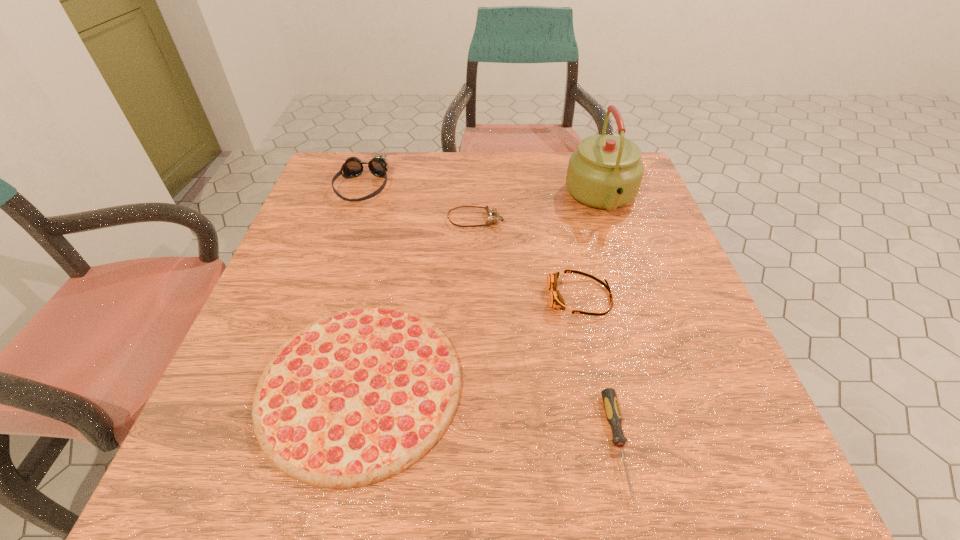
At what (x,y) coordinates should I click in order to perform the action: click on vacant space located through the lenses of the second tallest object. Please return your answer as a coordinate pair (x, y). Looking at the image, I should click on (330, 281).

The image size is (960, 540). What are the coordinates of `free space located with the lenses facing forward on the third tallest object` in the screenshot? It's located at (514, 298).

This screenshot has width=960, height=540. In order to click on vacant area situated 0.390m with the lenses facing forward on the third tallest object in this screenshot , I will do (x=355, y=298).

This screenshot has width=960, height=540. I want to click on vacant region located 0.160m with the lenses facing forward on the third tallest object, so click(x=468, y=298).

Where is `free region located on the front lenses and sides of the second goggles from left to right`? free region located on the front lenses and sides of the second goggles from left to right is located at coordinates pyautogui.click(x=656, y=220).

What are the coordinates of `vacant region located on the right of the pizza` in the screenshot? It's located at (637, 386).

The width and height of the screenshot is (960, 540). In order to click on kettle located at the far edge in this screenshot , I will do coord(605,172).

The height and width of the screenshot is (540, 960). I want to click on goggles that is at the far edge, so (x=353, y=167).

Identify the location of pizza situated at the near edge. (357, 396).

Where is `screwdriver located in the near edge section of the desktop`? screwdriver located in the near edge section of the desktop is located at coordinates (612, 410).